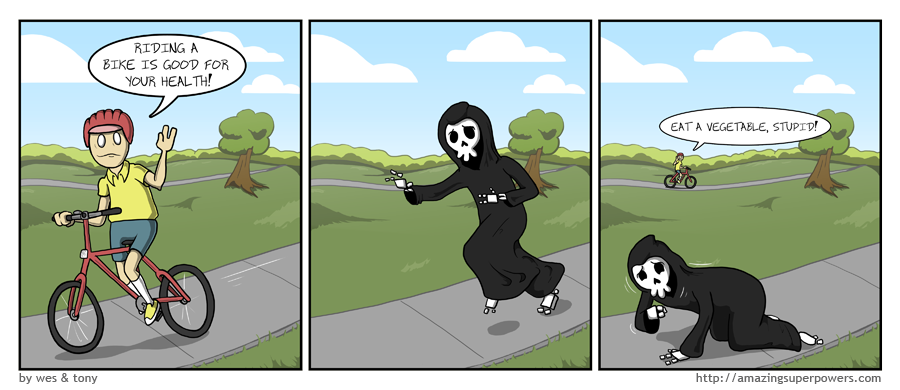
This screenshot has width=900, height=390. Find the location of `robe`. robe is located at coordinates (508, 272).